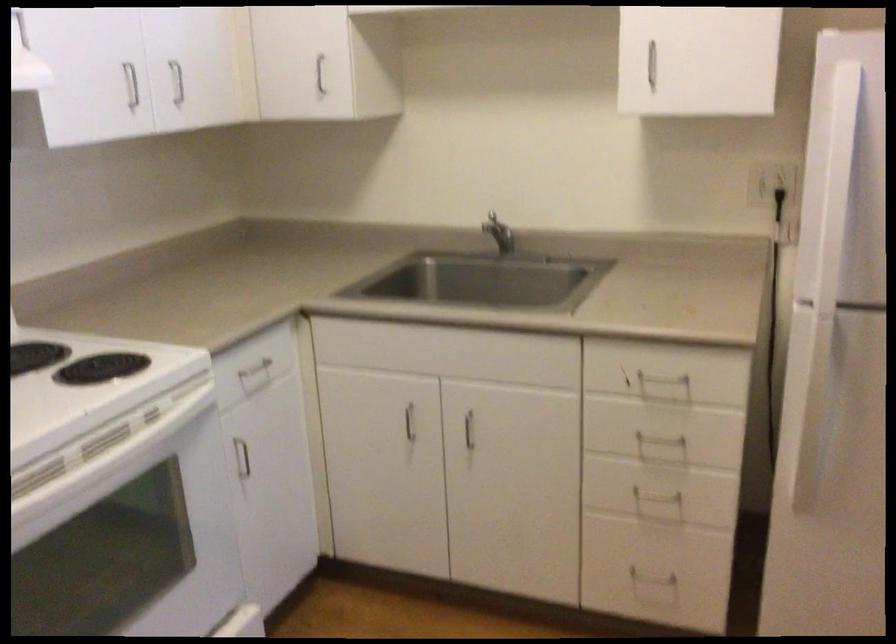
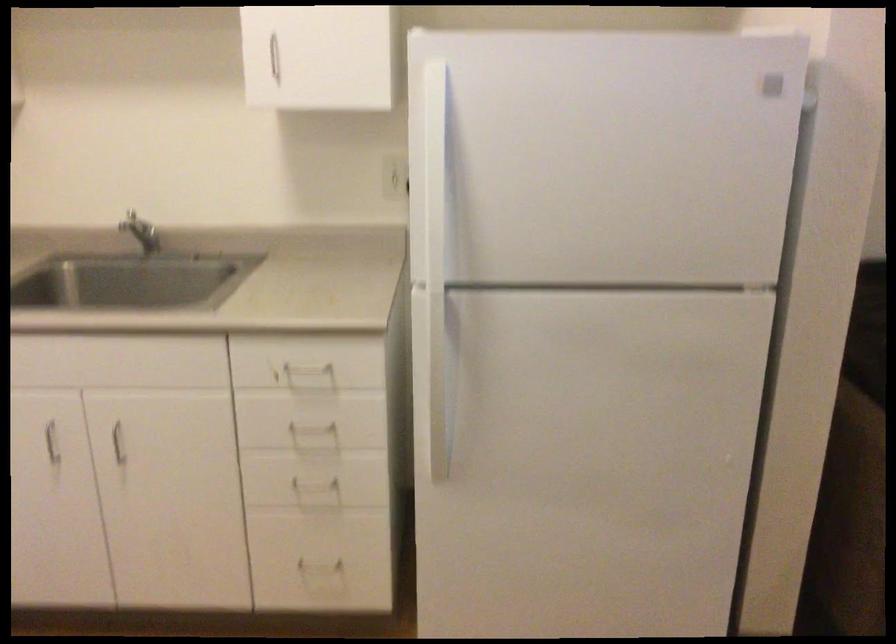
Locate, in the second image, the point that corresponds to point 659,450 in the first image.

(314, 436)